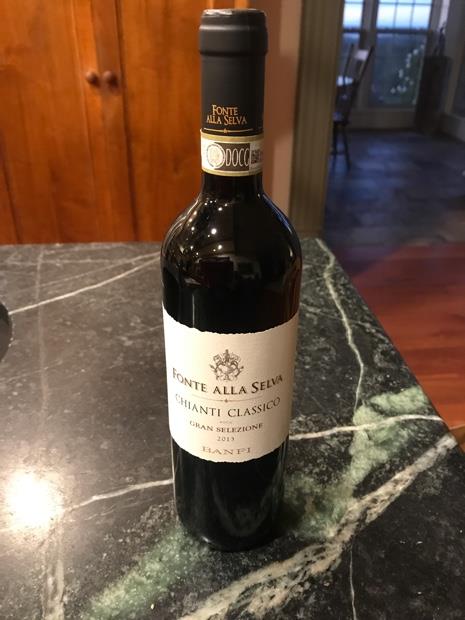
Identify the location of wall. [277, 37], [280, 169].